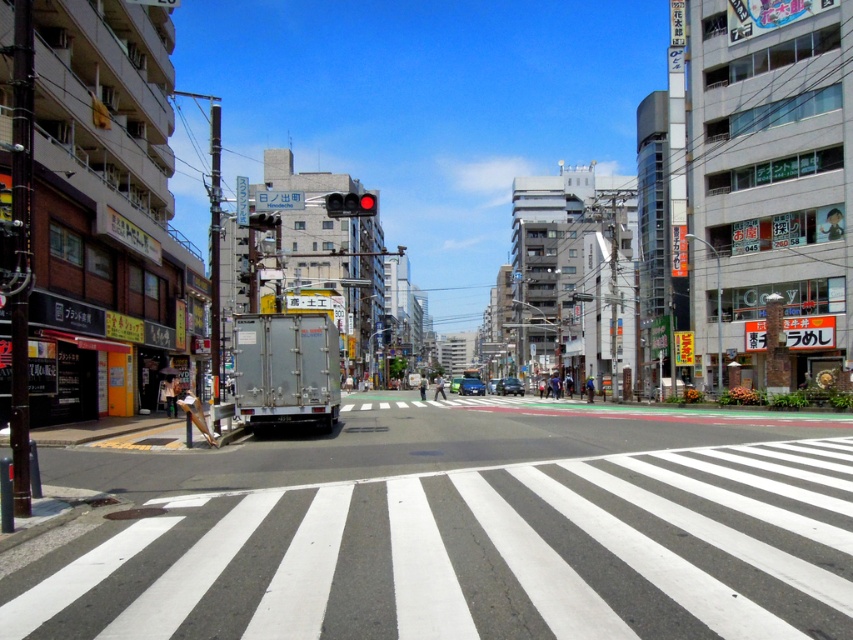
You are standing at the crosswalk in the middle of the street. You see two points marked on the ground ahead of you. The first is at point [518,380] and the second is at point [451,390]. Which point is closer to you?

Point [518,380] is in front of point [451,390], so the first point is closer to you.

You are a pedestrian standing at the crosswalk. You see a matte black car at center and a metallic silver van at center. Which vehicle is closer to you?

The matte black car at center is closer to you because it is in front of the metallic silver van at center.